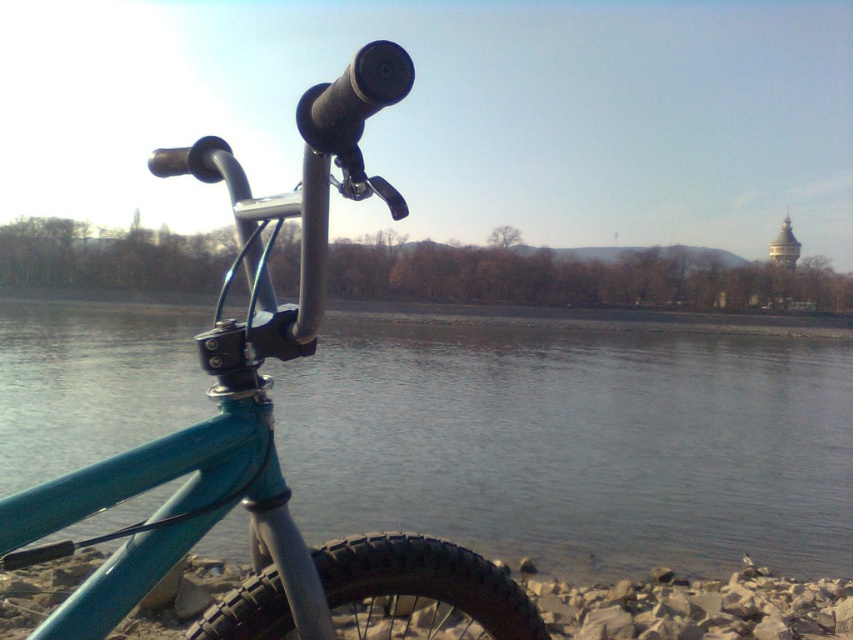
Question: Does blue metallic water at lower center appear under teal matte bicycle at center?

Choices:
 (A) no
 (B) yes

Answer: (A)

Question: Does blue metallic water at lower center have a greater width compared to teal matte bicycle at center?

Choices:
 (A) no
 (B) yes

Answer: (B)

Question: Is blue metallic water at lower center behind teal matte bicycle at center?

Choices:
 (A) no
 (B) yes

Answer: (B)

Question: Among these points, which one is farthest from the camera?

Choices:
 (A) (18, 548)
 (B) (140, 394)

Answer: (B)

Question: Which object appears closest to the camera in this image?

Choices:
 (A) blue metallic water at lower center
 (B) teal matte bicycle at center

Answer: (B)